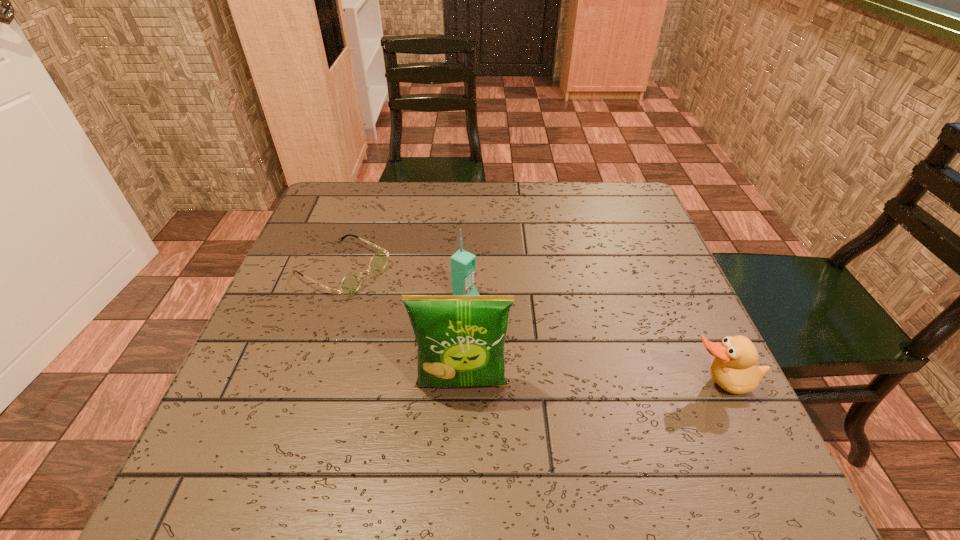
Locate an element on the screen. free space on the desktop that is between the tallest object and the third tallest object and is positioned on the keypad of the second tallest object is located at coordinates (628, 384).

The image size is (960, 540). In order to click on vacant space on the desktop that is between the crisp (potato chip) and the duck and is positioned on the lenses of the spectacles in this screenshot , I will do `click(556, 385)`.